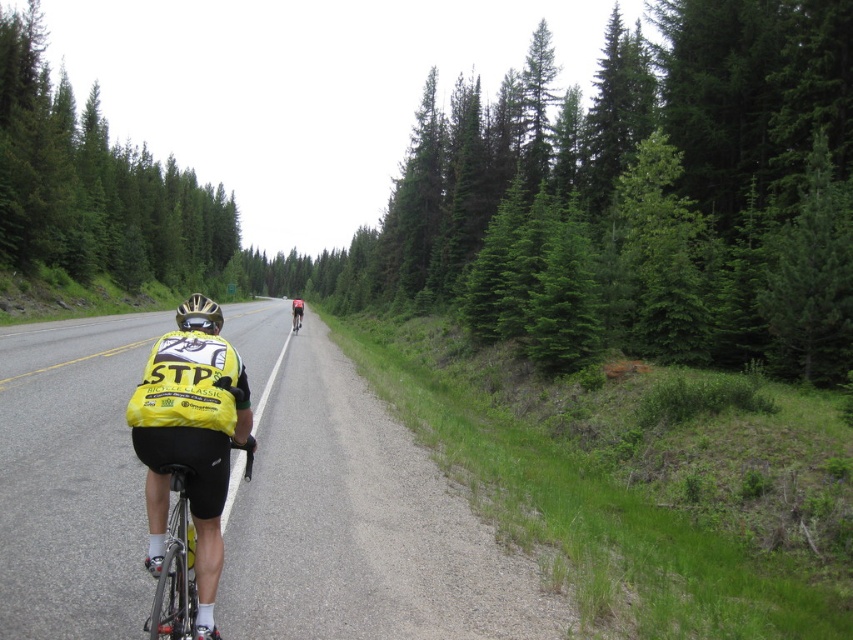
You are a photographer planning to take a wide shot of the scene. Given that the smooth asphalt road at center is larger in size than the black matte bicycle at center, will the bicycle be easily visible in the photo?

The black matte bicycle at center will be visible but smaller in the photo since the smooth asphalt road at center is larger in size than it.

Based on the coordinates provided, what is the terrain type at point (354, 513) in the scene?

The point (354, 513) indicates smooth asphalt road at center.